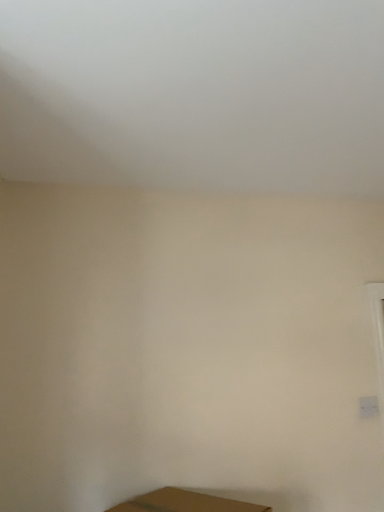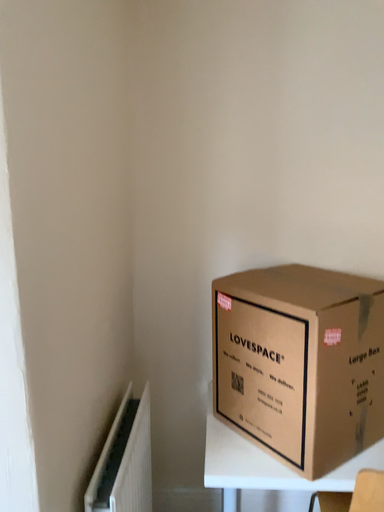
Question: Which way did the camera rotate in the video?

Choices:
 (A) rotated upward
 (B) rotated downward

Answer: (B)